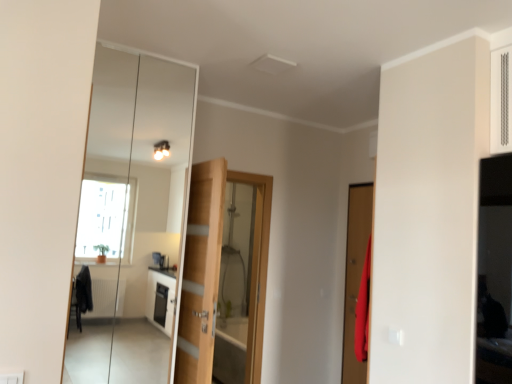
Question: Can you confirm if matte wooden door at right, which ranks as the second door in left-to-right order, is bigger than clear glass mirror at center?

Choices:
 (A) yes
 (B) no

Answer: (B)

Question: Considering the relative positions of matte wooden door at right, which is counted as the second door, starting from the back, and clear glass mirror at center in the image provided, is matte wooden door at right, which is counted as the second door, starting from the back, to the left of clear glass mirror at center from the viewer's perspective?

Choices:
 (A) yes
 (B) no

Answer: (B)

Question: Is matte wooden door at right, which is counted as the second door, starting from the back, touching clear glass mirror at center?

Choices:
 (A) yes
 (B) no

Answer: (B)

Question: Is matte wooden door at right, which ranks as the second door in left-to-right order, wider than clear glass mirror at center?

Choices:
 (A) no
 (B) yes

Answer: (A)

Question: Is matte wooden door at right, which is counted as the second door, starting from the back, behind clear glass mirror at center?

Choices:
 (A) no
 (B) yes

Answer: (B)

Question: Does matte wooden door at right, which is counted as the first door, starting from the right, turn towards clear glass mirror at center?

Choices:
 (A) no
 (B) yes

Answer: (A)

Question: Is clear glass mirror at center at the right side of wooden door at center, marked as the first door in a back-to-front arrangement?

Choices:
 (A) no
 (B) yes

Answer: (A)

Question: Is clear glass mirror at center directly adjacent to wooden door at center, marked as the first door in a back-to-front arrangement?

Choices:
 (A) yes
 (B) no

Answer: (B)

Question: From a real-world perspective, is clear glass mirror at center under wooden door at center, the 2th door from the front?

Choices:
 (A) yes
 (B) no

Answer: (B)

Question: Considering the relative sizes of clear glass mirror at center and wooden door at center, the 2th door from the front, in the image provided, is clear glass mirror at center taller than wooden door at center, the 2th door from the front,?

Choices:
 (A) no
 (B) yes

Answer: (B)

Question: From a real-world perspective, is clear glass mirror at center on top of wooden door at center, the 2th door from the front?

Choices:
 (A) no
 (B) yes

Answer: (B)

Question: Considering the relative sizes of clear glass mirror at center and wooden door at center, placed as the first door when sorted from left to right, in the image provided, is clear glass mirror at center shorter than wooden door at center, placed as the first door when sorted from left to right,?

Choices:
 (A) yes
 (B) no

Answer: (B)

Question: Is clear glass mirror at center bigger than matte wooden door at right, which is counted as the second door, starting from the back?

Choices:
 (A) yes
 (B) no

Answer: (A)